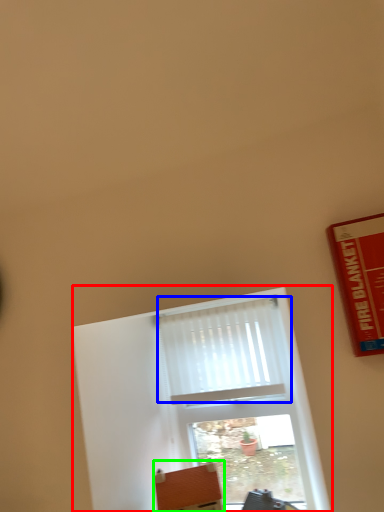
Question: Which object is the closest to the window (highlighted by a red box)? Choose among these: curtain (highlighted by a blue box) or furniture (highlighted by a green box).

Choices:
 (A) curtain
 (B) furniture

Answer: (A)